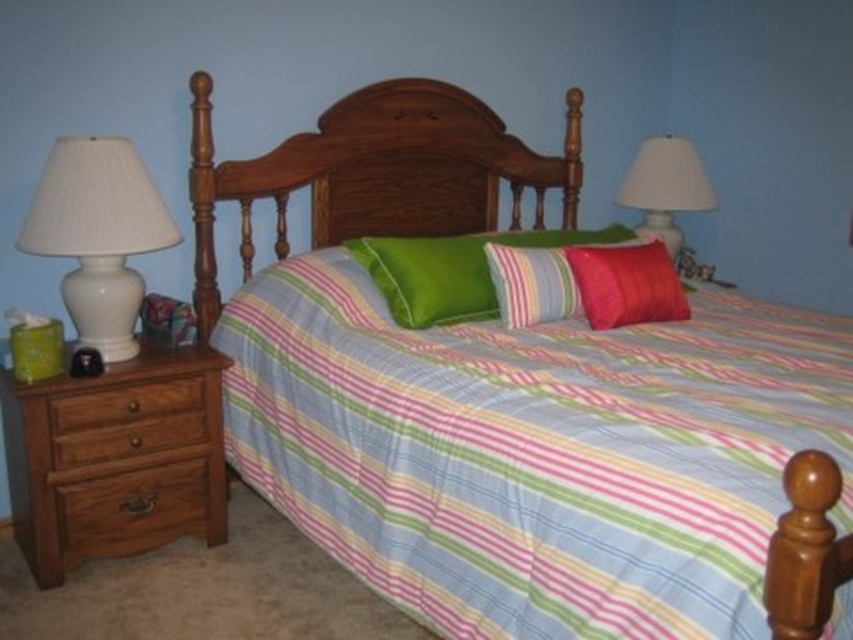
You are organizing the items on the bedside table and need to know which object has a greater width between the white ceramic lamp at left and the brown wood drawer at lower left. Could you determine which one is wider?

The white ceramic lamp at left is wider than the brown wood drawer at lower left according to the description.

Based on the provided scene description, where is the brown wood dresser at left located in the image?

The brown wood dresser at left is located at point (115, 458) in the image.